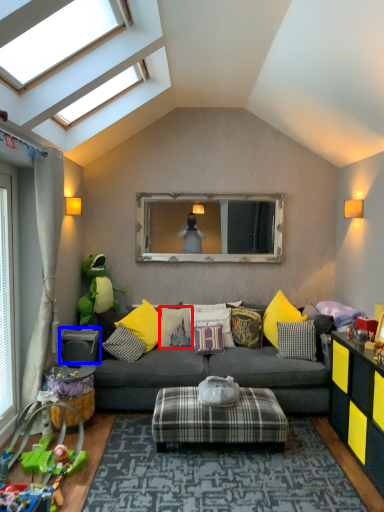
Question: Among these objects, which one is farthest to the camera, pillow (highlighted by a red box) or table (highlighted by a blue box)?

Choices:
 (A) pillow
 (B) table

Answer: (A)